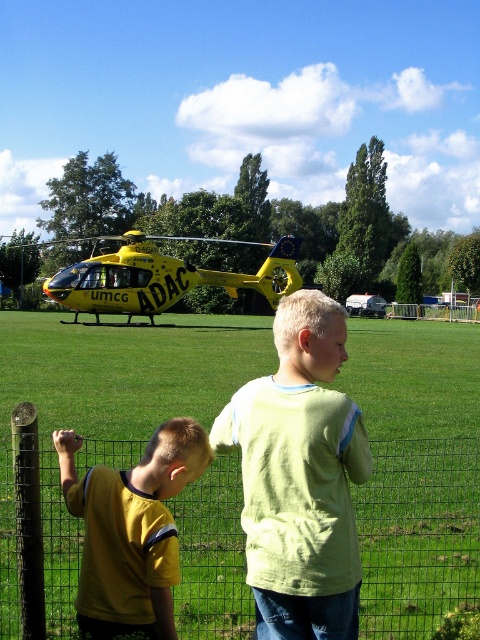
You are a drone operator planning to fly a small drone over the wire mesh fence at lower center and the yellow matte helicopter at upper center. Based on their positions, can the drone safely pass between them without any collision?

The wire mesh fence at lower center is in front of the yellow matte helicopter at upper center, so the drone would have to fly over the fence first before reaching the helicopter. Since they are not overlapping spatially, the drone can safely pass between them without collision.

You are a drone operator who needs to fly your drone over the wire mesh fence at lower center to capture a photo of the yellow matte helicopter at upper center. Can your drone clear the fence in height?

The wire mesh fence at lower center is not as tall as yellow matte helicopter at upper center, so yes, the drone can clear the fence in height since the helicopter is taller than the fence.

You are standing in front of the wire mesh fence at lower center and want to reach the yellow helicopter parked on the grassy field. The fence is 6.90 meters away from you. Can you walk through the fence to get to the helicopter?

The wire mesh fence at lower center is 6.90 meters from viewer, so you cannot walk through the fence to reach the helicopter since fences typically block passage unless there is an open gate or path.